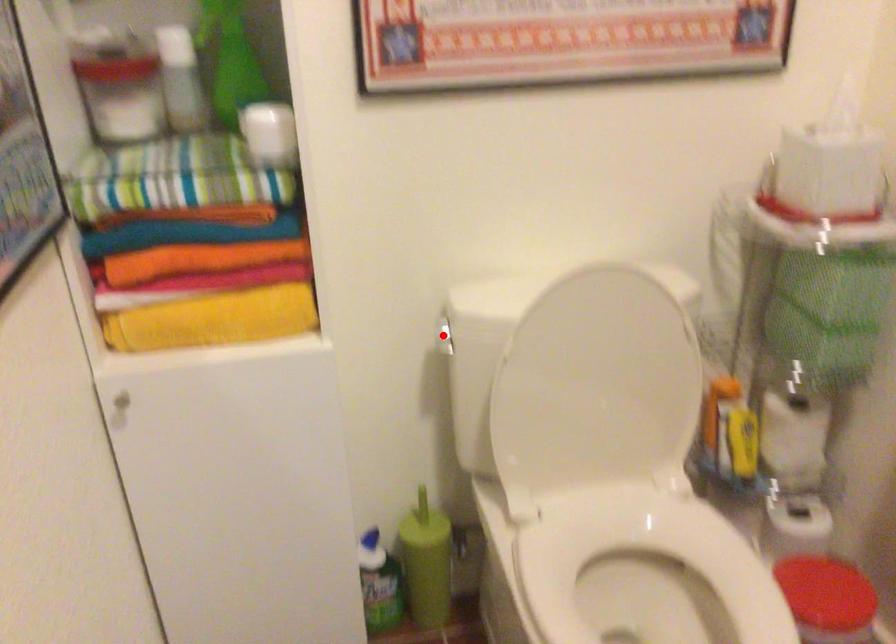
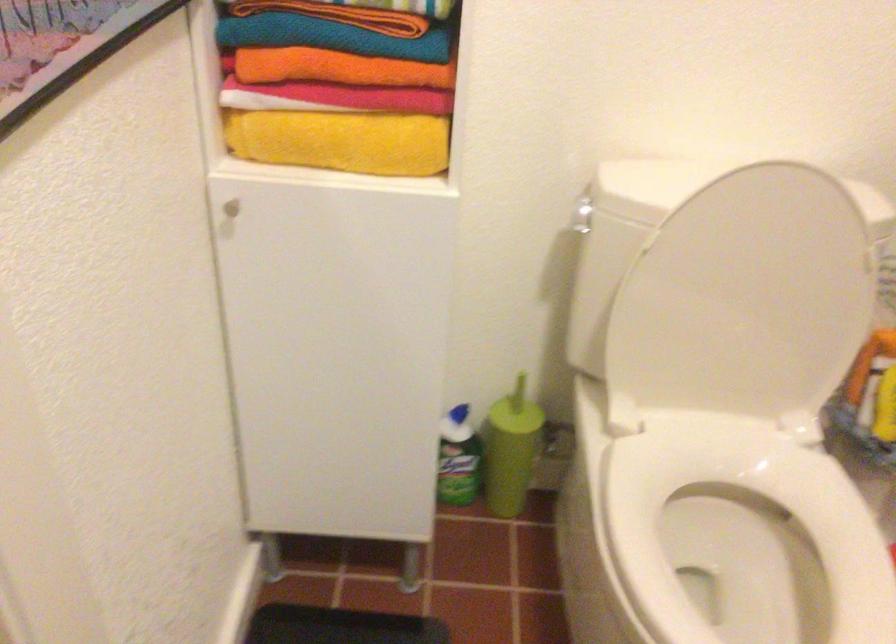
Question: I am providing you with two images of the same scene from different viewpoints. In image1, a red point is highlighted. Considering the same 3D point in image2, which of the following is correct?

Choices:
 (A) It is closer
 (B) It is farther

Answer: (A)